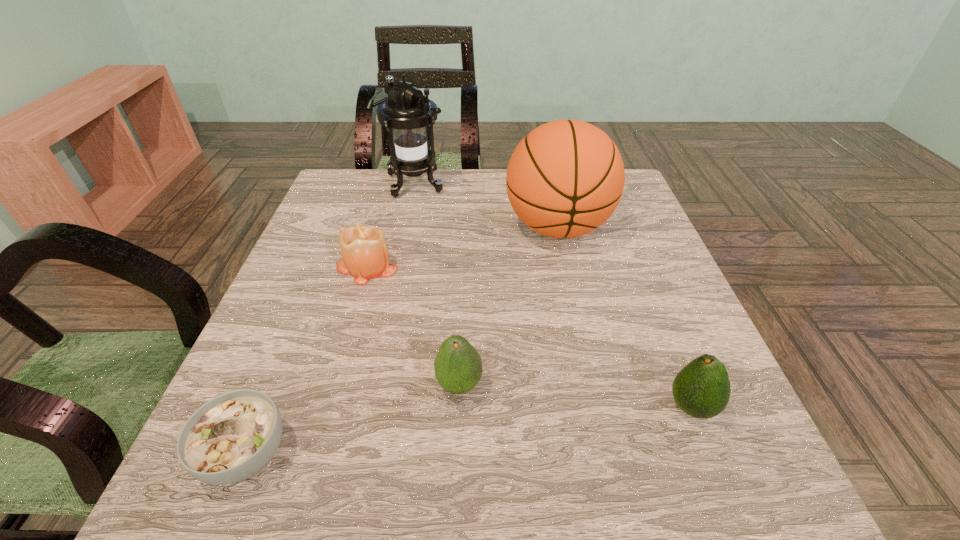
This screenshot has width=960, height=540. I want to click on object located at the far left corner, so (x=408, y=112).

The height and width of the screenshot is (540, 960). I want to click on object at the near left corner, so click(x=231, y=437).

This screenshot has height=540, width=960. In order to click on object located at the far right corner in this screenshot , I will do `click(565, 178)`.

Locate an element on the screen. This screenshot has width=960, height=540. free space at the far edge is located at coordinates (471, 215).

The image size is (960, 540). In order to click on free space at the near edge of the desktop in this screenshot , I will do `click(355, 457)`.

The width and height of the screenshot is (960, 540). I want to click on vacant space at the left edge of the desktop, so pyautogui.click(x=315, y=220).

Image resolution: width=960 pixels, height=540 pixels. In order to click on free region at the right edge in this screenshot , I will do `click(626, 311)`.

Where is `free location at the near left corner`? free location at the near left corner is located at coordinates (278, 502).

At what (x,y) coordinates should I click in order to perform the action: click on vacant area that lies between the basketball and the left avocado. Please return your answer as a coordinate pair (x, y). The width and height of the screenshot is (960, 540). Looking at the image, I should click on (509, 306).

The width and height of the screenshot is (960, 540). Find the location of `free space between the soup bowl and the third object from right to left`. free space between the soup bowl and the third object from right to left is located at coordinates (352, 420).